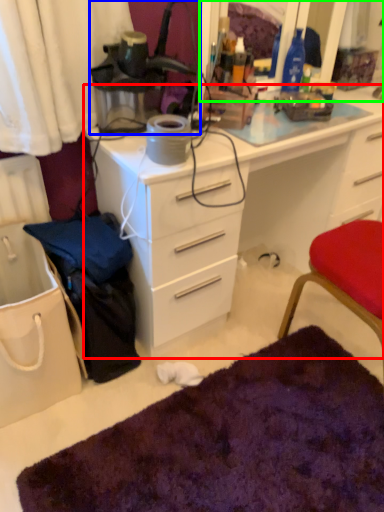
Question: Considering the real-world distances, which object is closest to desk (highlighted by a red box)? lamp (highlighted by a blue box) or mirror (highlighted by a green box).

Choices:
 (A) lamp
 (B) mirror

Answer: (A)